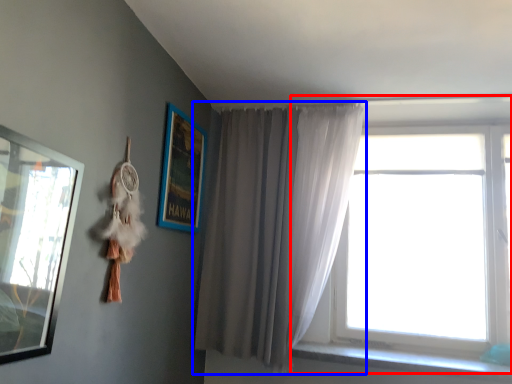
Question: Which object appears farthest to the camera in this image, window (highlighted by a red box) or curtain (highlighted by a blue box)?

Choices:
 (A) window
 (B) curtain

Answer: (A)